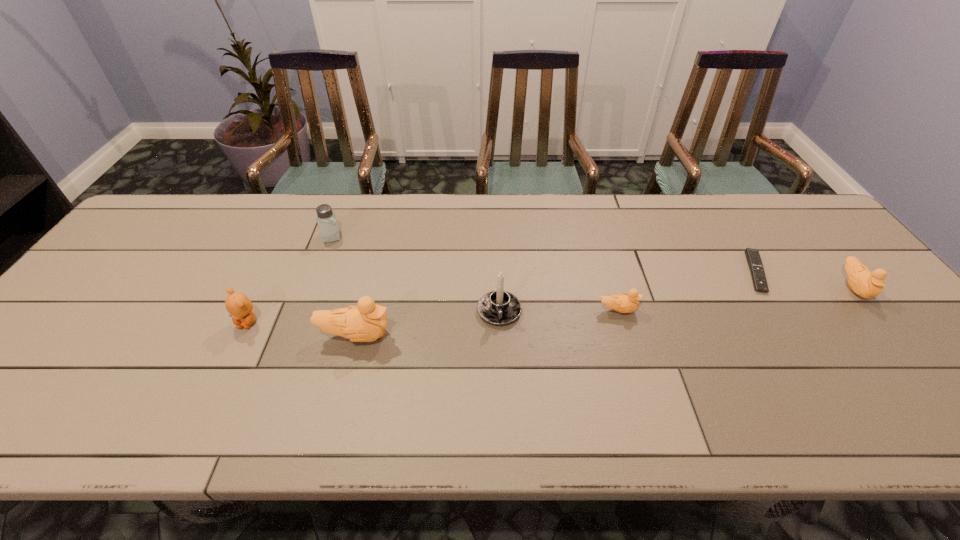
I want to click on the sixth object from left to right, so click(x=753, y=257).

In order to click on the shortest object in this screenshot , I will do `click(753, 257)`.

This screenshot has width=960, height=540. What are the coordinates of `vacant position located 0.360m on the face of the tallest duckling` in the screenshot? It's located at (542, 335).

Image resolution: width=960 pixels, height=540 pixels. I want to click on vacant area situated on the face of the second duckling from left to right, so click(716, 310).

I want to click on vacant area situated 0.060m on the face of the rightmost object, so click(883, 323).

This screenshot has width=960, height=540. In order to click on vacant region located 0.140m with a handle on the side of the candle holder in this screenshot , I will do `click(502, 378)`.

Locate an element on the screen. free region located 0.170m on the right of the saltshaker is located at coordinates (399, 237).

I want to click on vacant space situated 0.050m on the face of the leftmost object, so click(235, 348).

Where is `vacant region located 0.230m on the left of the remote control`? The height and width of the screenshot is (540, 960). vacant region located 0.230m on the left of the remote control is located at coordinates (659, 272).

Where is `object that is at the far edge`? This screenshot has height=540, width=960. object that is at the far edge is located at coordinates (329, 229).